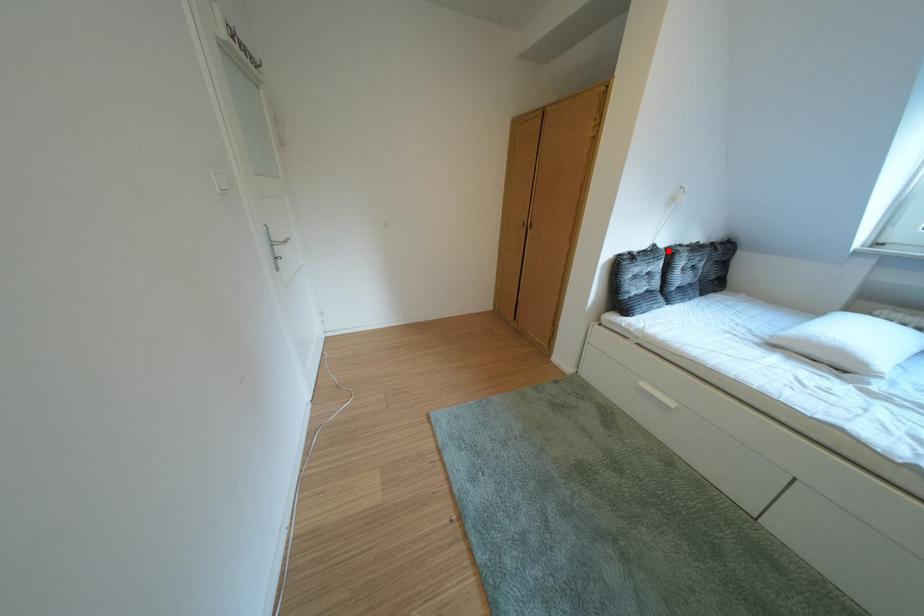
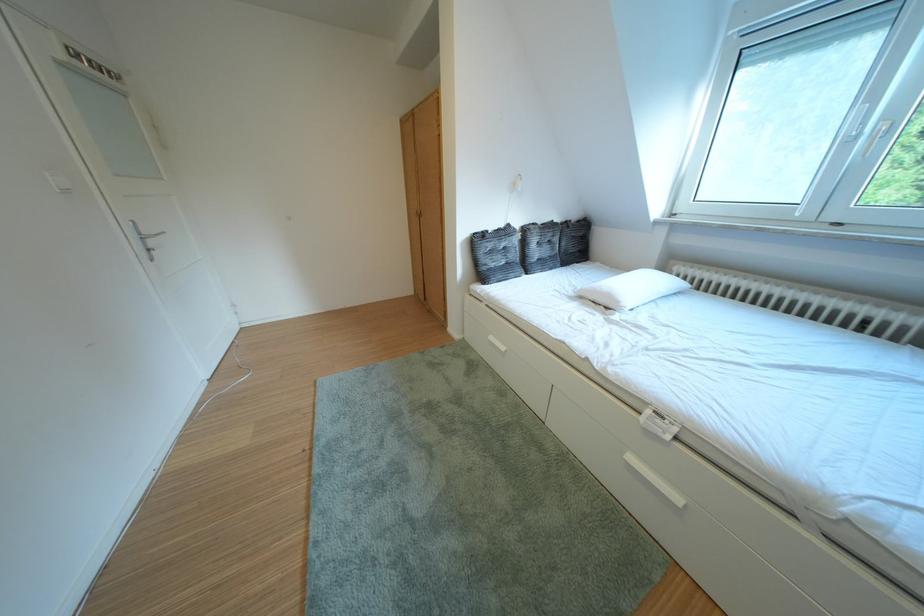
Question: I am providing you with two images of the same scene from different viewpoints. Given a red point in image1, look at the same physical point in image2. Is it:

Choices:
 (A) Closer to the viewpoint
 (B) Farther from the viewpoint

Answer: (A)